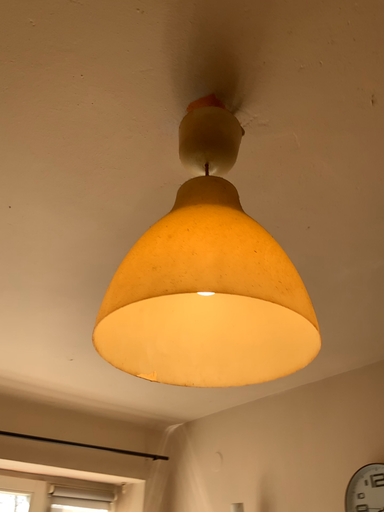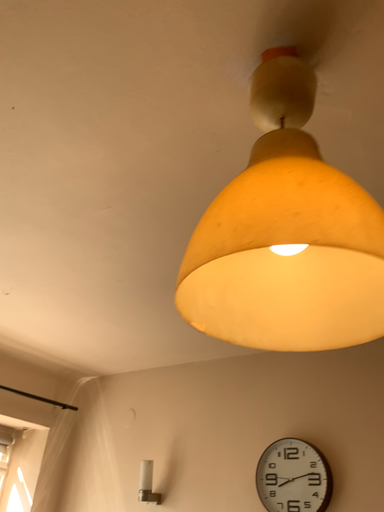
Question: Which way did the camera rotate in the video?

Choices:
 (A) rotated right
 (B) rotated left

Answer: (A)